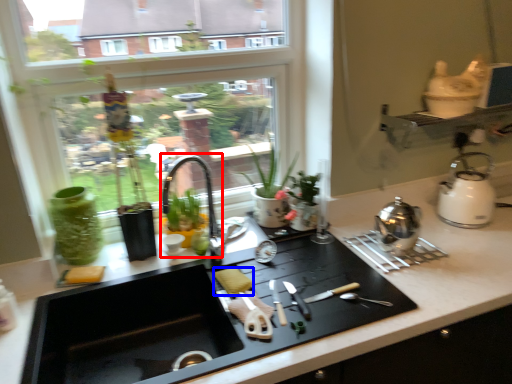
Question: Which object is further to the camera taking this photo, faucet (highlighted by a red box) or food (highlighted by a blue box)?

Choices:
 (A) faucet
 (B) food

Answer: (A)